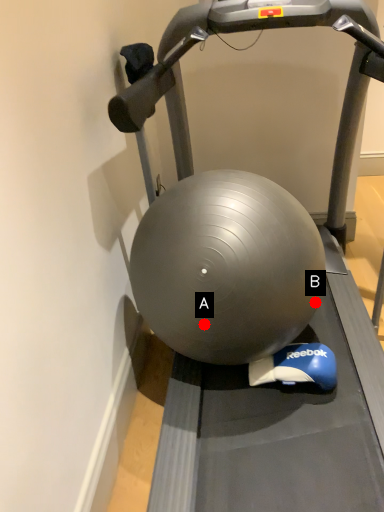
Question: Two points are circled on the image, labeled by A and B beside each circle. Which point appears closest to the camera in this image?

Choices:
 (A) A is closer
 (B) B is closer

Answer: (A)